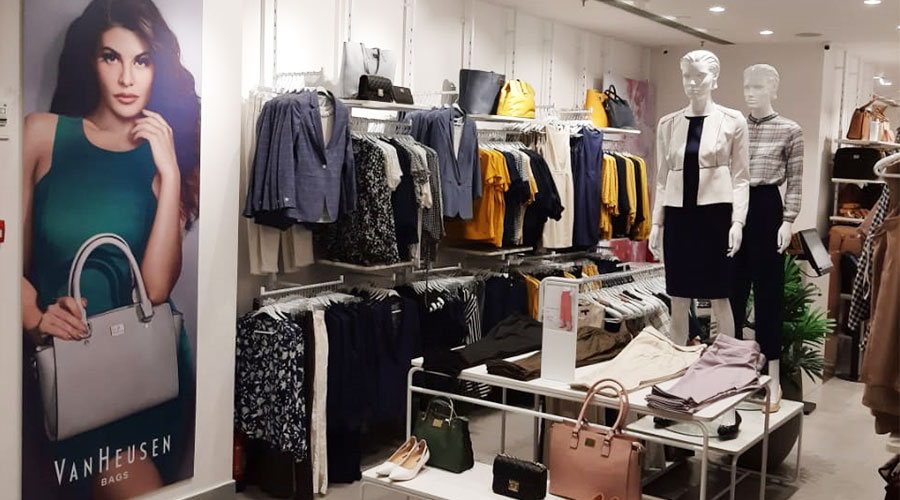
Image resolution: width=900 pixels, height=500 pixels. I want to click on ceiling, so click(x=832, y=26).